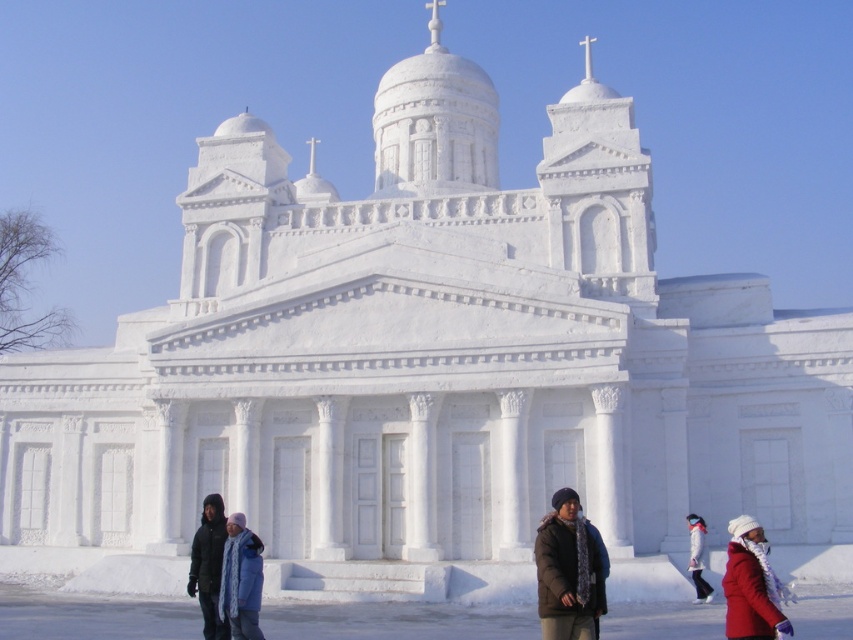
Based on the photo, you are standing at the entrance of the grand snow covered structure and see the light blue fabric coat at lower center. What is the color of the object located at coordinate point (241, 579)?

The object at coordinate point (241, 579) is the light blue fabric coat at lower center.

You are standing at the entrance of the snow covered building and see a light blue fabric coat at lower center and a dark gray jacket at lower left. You need to retrieve both items. Which item is closer to your current position?

The light blue fabric coat at lower center is closer to your current position because it is only 7.03 meters away from the dark gray jacket at lower left, but without knowing the exact distance from the entrance, we can infer based on their positions that the lower center item is likely closer.

You are standing at the entrance of the snow covered classical building. You see a red woolen scarf at lower right. Where exactly is the red woolen scarf located in the image?

The red woolen scarf at lower right is located at the coordinates point (750, 584) in the image.